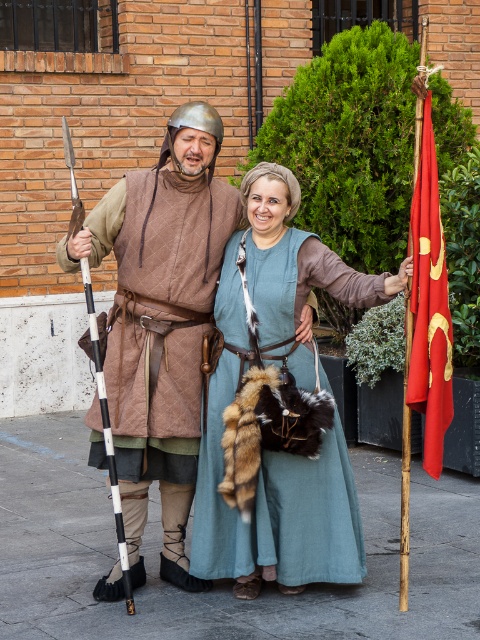
How far apart are teal linen dress at center and white and black speckled staff at left?

teal linen dress at center and white and black speckled staff at left are 26.73 inches apart.

In the scene shown: Who is taller, teal linen dress at center or white and black speckled staff at left?

With more height is white and black speckled staff at left.

Is point (260, 573) farther from camera compared to point (109, 476)?

Yes, point (260, 573) is farther from viewer.

Find the location of a particular element. Image resolution: width=480 pixels, height=640 pixels. teal linen dress at center is located at coordinates (274, 451).

Is quilted brown vest at left wider than white and black speckled staff at left?

Indeed, quilted brown vest at left has a greater width compared to white and black speckled staff at left.

Who is positioned more to the left, quilted brown vest at left or white and black speckled staff at left?

white and black speckled staff at left

Describe the element at coordinates (160, 321) in the screenshot. I see `quilted brown vest at left` at that location.

Locate an element on the screen. quilted brown vest at left is located at coordinates (160, 321).

Who is taller, quilted brown vest at left or teal linen dress at center?

quilted brown vest at left

Does quilted brown vest at left appear over teal linen dress at center?

Yes, quilted brown vest at left is above teal linen dress at center.

Between point (188, 168) and point (292, 209), which one is positioned in front?

Positioned in front is point (188, 168).

You are a GUI agent. You are given a task and a screenshot of the screen. Output one action in this format:
    pyautogui.click(x=<x>, y=<y>)
    Task: Click on the quilted brown vest at left
    The image size is (480, 640).
    Given the screenshot: What is the action you would take?
    pyautogui.click(x=160, y=321)